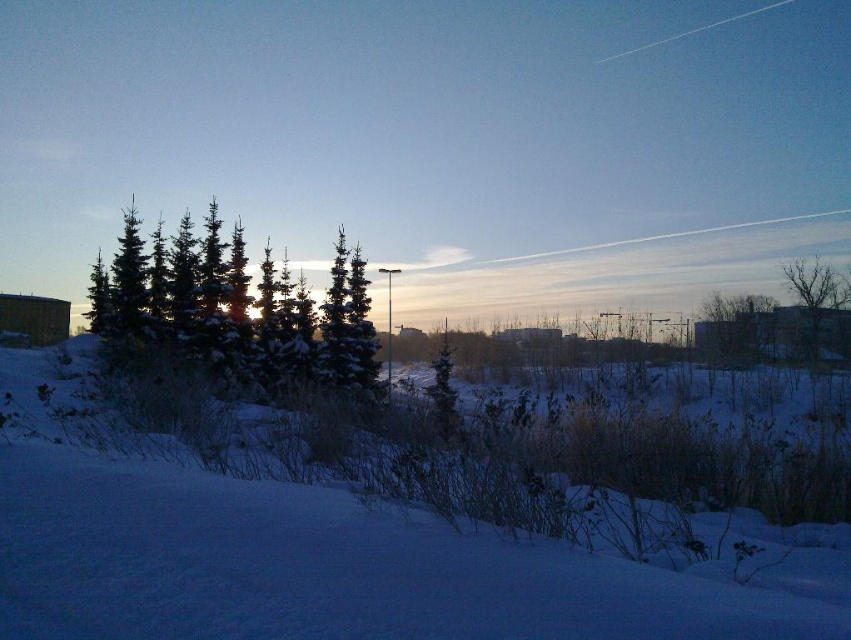
Question: Which is farther from the bare branches at right?

Choices:
 (A) snow-covered evergreen trees at left
 (B) snow-covered evergreen at center
 (C) white fluffy snow at center

Answer: (C)

Question: Which is nearer to the bare branches at right?

Choices:
 (A) snow-covered evergreen at center
 (B) snow-covered evergreen trees at left
 (C) white fluffy snow at center

Answer: (A)

Question: Is snow-covered evergreen trees at left closer to camera compared to snow-covered evergreen at center?

Choices:
 (A) no
 (B) yes

Answer: (B)

Question: Which object is the closest to the snow-covered evergreen at center?

Choices:
 (A) bare branches at right
 (B) white fluffy snow at center

Answer: (B)

Question: Is snow-covered evergreen at center below bare branches at right?

Choices:
 (A) yes
 (B) no

Answer: (B)

Question: Observing the image, what is the correct spatial positioning of white fluffy snow at center in reference to snow-covered evergreen at center?

Choices:
 (A) above
 (B) below

Answer: (B)